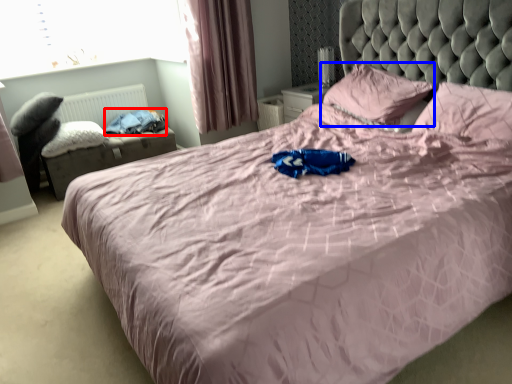
Question: Which point is further to the camera, clothing (highlighted by a red box) or pillow (highlighted by a blue box)?

Choices:
 (A) clothing
 (B) pillow

Answer: (A)